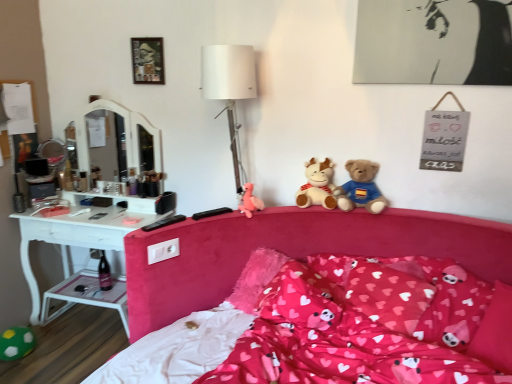
The height and width of the screenshot is (384, 512). I want to click on white fabric lampshade at center, so click(x=230, y=87).

In order to face white plush reindeer at center, which ranks as the 3th toy in left-to-right order, should I rotate leftwards or rightwards?

You should rotate right by 8.293 degrees.

Where is `white plush reindeer at center, which is the third toy from bottom to top`? The height and width of the screenshot is (384, 512). white plush reindeer at center, which is the third toy from bottom to top is located at coordinates 317,185.

Measure the distance between pink plush pillow at center, arranged as the second pillow when viewed from the left, and camera.

pink plush pillow at center, arranged as the second pillow when viewed from the left, and camera are 1.65 meters apart.

Where is `soft plush teddy bear at center`? Image resolution: width=512 pixels, height=384 pixels. soft plush teddy bear at center is located at coordinates (360, 188).

Image resolution: width=512 pixels, height=384 pixels. What are the coordinates of `white fabric lampshade at center` in the screenshot? It's located at (230, 87).

Considering the positions of point (511, 353) and point (161, 75), is point (511, 353) closer or farther from the camera than point (161, 75)?

Point (511, 353) appears to be closer to the viewer than point (161, 75).

From the image's perspective, is pink fluffy pillow at center, which is the 3th pillow from left to right, positioned above or below metallic silver picture frame at upper center?

pink fluffy pillow at center, which is the 3th pillow from left to right, is below metallic silver picture frame at upper center.

Based on the photo, is metallic silver picture frame at upper center inside pink fluffy pillow at center, which ranks as the 1th pillow in right-to-left order?

Definitely not — metallic silver picture frame at upper center is not inside pink fluffy pillow at center, which ranks as the 1th pillow in right-to-left order.

Who is more distant, pink plush duck at center, the second toy positioned from the bottom, or white plush reindeer at center, the first toy positioned from the top?

white plush reindeer at center, the first toy positioned from the top, is further away from the camera.

Is pink plush duck at center, which is the second toy from right to left, with white plush reindeer at center, the 1th toy in the right-to-left sequence?

No, pink plush duck at center, which is the second toy from right to left, is not next to white plush reindeer at center, the 1th toy in the right-to-left sequence.

Is pink plush duck at center, the second toy positioned from the bottom, taller or shorter than white plush reindeer at center, the first toy positioned from the top?

Considering their sizes, pink plush duck at center, the second toy positioned from the bottom, has less height than white plush reindeer at center, the first toy positioned from the top.

From the image's perspective, would you say pink plush duck at center, the second toy from the top, is shown under white plush reindeer at center, which is the third toy from bottom to top?

Yes, from the image's perspective, pink plush duck at center, the second toy from the top, is beneath white plush reindeer at center, which is the third toy from bottom to top.

Is pink plush pillow at center, the 2th pillow in the right-to-left sequence, not inside fluffy pink pillow at center, which appears as the first pillow when viewed from the left?

That's correct, pink plush pillow at center, the 2th pillow in the right-to-left sequence, is outside of fluffy pink pillow at center, which appears as the first pillow when viewed from the left.

Between point (452, 298) and point (329, 298), which one is positioned behind?

Point (329, 298)

Consider the image. Are pink plush pillow at center, arranged as the second pillow when viewed from the left, and fluffy pink pillow at center, the third pillow from the right, making contact?

No.

Which object is positioned more to the right, pink plush pillow at center, the 2th pillow in the right-to-left sequence, or fluffy pink pillow at center, the third pillow from the right?

Positioned to the right is pink plush pillow at center, the 2th pillow in the right-to-left sequence.

In terms of height, does green fuzzy ball at lower left, the 1th toy ordered from the bottom, look taller or shorter compared to soft plush teddy bear at center?

Considering their sizes, green fuzzy ball at lower left, the 1th toy ordered from the bottom, has less height than soft plush teddy bear at center.

Find the location of a particular element. This screenshot has height=384, width=512. teddy bear in front of the green fuzzy ball at lower left, the 1th toy ordered from the bottom is located at coordinates (360, 188).

Is green fuzzy ball at lower left, arranged as the third toy when viewed from the top, further to camera compared to soft plush teddy bear at center?

That is True.

Does green fuzzy ball at lower left, arranged as the third toy when viewed from the top, have a larger size compared to soft plush teddy bear at center?

Actually, green fuzzy ball at lower left, arranged as the third toy when viewed from the top, might be smaller than soft plush teddy bear at center.

Considering the sizes of white plastic side table at lower left and white plush reindeer at center, which is the third toy from bottom to top, in the image, is white plastic side table at lower left taller or shorter than white plush reindeer at center, which is the third toy from bottom to top,?

Clearly, white plastic side table at lower left is shorter compared to white plush reindeer at center, which is the third toy from bottom to top.

Is white plastic side table at lower left wider than white plush reindeer at center, which ranks as the 3th toy in left-to-right order?

Indeed, white plastic side table at lower left has a greater width compared to white plush reindeer at center, which ranks as the 3th toy in left-to-right order.

Is white plastic side table at lower left not inside white plush reindeer at center, the first toy positioned from the top?

Yes.

Which object is positioned more to the left, velvet pink bed at center or green fuzzy ball at lower left, acting as the first toy starting from the left?

Positioned to the left is green fuzzy ball at lower left, acting as the first toy starting from the left.

Is velvet pink bed at center completely or partially outside of green fuzzy ball at lower left, the 1th toy ordered from the bottom?

velvet pink bed at center is positioned outside green fuzzy ball at lower left, the 1th toy ordered from the bottom.

How different are the orientations of velvet pink bed at center and green fuzzy ball at lower left, acting as the first toy starting from the left, in degrees?

85.8 degrees.

Between velvet pink bed at center and metallic silver picture frame at upper center, which one has smaller width?

metallic silver picture frame at upper center is thinner.

Can you tell me how much velvet pink bed at center and metallic silver picture frame at upper center differ in facing direction?

The angle between the facing direction of velvet pink bed at center and the facing direction of metallic silver picture frame at upper center is 23.3 degrees.

Between velvet pink bed at center and metallic silver picture frame at upper center, which one appears on the left side from the viewer's perspective?

metallic silver picture frame at upper center.

From the image's perspective, does velvet pink bed at center appear higher than metallic silver picture frame at upper center?

No.

This screenshot has width=512, height=384. I want to click on the 2nd pillow in front of the metallic silver picture frame at upper center, starting your count from the anchor, so click(x=495, y=332).

Which toy is the 1st one when counting from the left side of the white plush reindeer at center, the 1th toy in the right-to-left sequence? Please provide its 2D coordinates.

[(249, 201)]

Looking at this image, from the image, which object appears to be farther from pink fluffy pillow at center, which is the 3th pillow from left to right, metallic silver picture frame at upper center or white plastic side table at lower left?

Based on the image, metallic silver picture frame at upper center appears to be further to pink fluffy pillow at center, which is the 3th pillow from left to right.

Estimate the real-world distances between objects in this image. Which object is further from green fuzzy ball at lower left, acting as the first toy starting from the left, velvet pink bed at center or metallic silver picture frame at upper center?

Among the two, metallic silver picture frame at upper center is located further to green fuzzy ball at lower left, acting as the first toy starting from the left.

Looking at the image, which one is located further to white fabric lampshade at center, soft plush teddy bear at center or fluffy pink pillow at center, which appears as the first pillow when viewed from the left?

fluffy pink pillow at center, which appears as the first pillow when viewed from the left, is positioned further to the anchor white fabric lampshade at center.

Which object lies further to the anchor point pink fluffy pillow at center, which ranks as the 1th pillow in right-to-left order, velvet pink bed at center or fluffy pink pillow at center, which appears as the first pillow when viewed from the left?

Among the two, fluffy pink pillow at center, which appears as the first pillow when viewed from the left, is located further to pink fluffy pillow at center, which ranks as the 1th pillow in right-to-left order.

Looking at the image, which one is located closer to white fabric lampshade at center, soft plush teddy bear at center or pink plush duck at center, the second toy in the left-to-right sequence?

The object closer to white fabric lampshade at center is pink plush duck at center, the second toy in the left-to-right sequence.

Based on their spatial positions, is pink plush duck at center, the second toy in the left-to-right sequence, or green fuzzy ball at lower left, positioned as the 3th toy in right-to-left order, further from pink plush pillow at center, the 2th pillow in the right-to-left sequence?

The object further to pink plush pillow at center, the 2th pillow in the right-to-left sequence, is green fuzzy ball at lower left, positioned as the 3th toy in right-to-left order.

Based on their spatial positions, is metallic silver picture frame at upper center or pink plush pillow at center, the 2th pillow in the right-to-left sequence, closer to pink plush duck at center, which is the second toy from right to left?

metallic silver picture frame at upper center lies closer to pink plush duck at center, which is the second toy from right to left, than the other object.

Estimate the real-world distances between objects in this image. Which object is further from green fuzzy ball at lower left, acting as the first toy starting from the left, velvet pink bed at center or pink plush pillow at center, arranged as the second pillow when viewed from the left?

pink plush pillow at center, arranged as the second pillow when viewed from the left, is positioned further to the anchor green fuzzy ball at lower left, acting as the first toy starting from the left.

Where is `pillow between velvet pink bed at center and pink fluffy pillow at center, which is the 3th pillow from left to right, from front to back`? The height and width of the screenshot is (384, 512). pillow between velvet pink bed at center and pink fluffy pillow at center, which is the 3th pillow from left to right, from front to back is located at coordinates (452, 304).

Where is `toy between white plush reindeer at center, which is the third toy from bottom to top, and fluffy pink pillow at center, the third pillow from the right, from top to bottom`? This screenshot has height=384, width=512. toy between white plush reindeer at center, which is the third toy from bottom to top, and fluffy pink pillow at center, the third pillow from the right, from top to bottom is located at coordinates (249, 201).

At what (x,y) coordinates should I click in order to perform the action: click on side table between green fuzzy ball at lower left, arranged as the third toy when viewed from the top, and fluffy pink pillow at center, which appears as the first pillow when viewed from the left, in the horizontal direction. Please return your answer as a coordinate pair (x, y). The height and width of the screenshot is (384, 512). Looking at the image, I should click on (86, 296).

The image size is (512, 384). What are the coordinates of `teddy bear that lies between white fabric lampshade at center and fluffy pink pillow at center, the third pillow from the right, from top to bottom` in the screenshot? It's located at (360, 188).